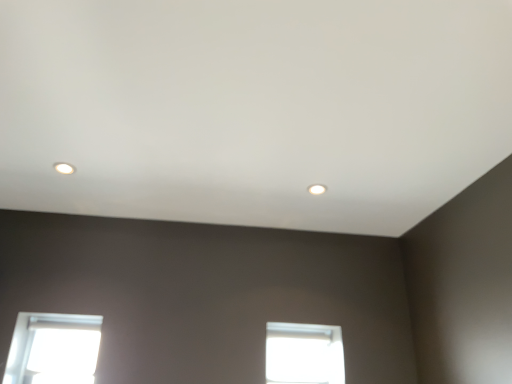
Question: Can you confirm if transparent glass window at lower left, the 1th window in the left-to-right sequence, is positioned to the right of matte white light fixture at upper center, marked as the 2th lighting in a left-to-right arrangement?

Choices:
 (A) no
 (B) yes

Answer: (A)

Question: Considering the relative positions of transparent glass window at lower left, which is the 2th window in right-to-left order, and matte white light fixture at upper center, which is the second lighting in front-to-back order, in the image provided, is transparent glass window at lower left, which is the 2th window in right-to-left order, behind matte white light fixture at upper center, which is the second lighting in front-to-back order,?

Choices:
 (A) no
 (B) yes

Answer: (B)

Question: Are transparent glass window at lower left, which is the 2th window in right-to-left order, and matte white light fixture at upper center, positioned as the second lighting in top-to-bottom order, making contact?

Choices:
 (A) no
 (B) yes

Answer: (A)

Question: Is matte white light fixture at upper center, positioned as the second lighting in top-to-bottom order, at the back of transparent glass window at lower left, the 1th window in the left-to-right sequence?

Choices:
 (A) yes
 (B) no

Answer: (B)

Question: Is transparent glass window at lower left, the 1th window in the left-to-right sequence, positioned in front of matte white light fixture at upper center, which is the 1th lighting from bottom to top?

Choices:
 (A) no
 (B) yes

Answer: (A)

Question: From the image's perspective, is matte white light fixture at upper left, the 2th lighting positioned from the right, positioned above or below matte white light fixture at upper center, positioned as the second lighting in top-to-bottom order?

Choices:
 (A) below
 (B) above

Answer: (B)

Question: Is point (67, 165) positioned closer to the camera than point (322, 185)?

Choices:
 (A) farther
 (B) closer

Answer: (B)

Question: From a real-world perspective, is matte white light fixture at upper left, which ranks as the first lighting in left-to-right order, physically located above or below matte white light fixture at upper center, which is the second lighting in front-to-back order?

Choices:
 (A) above
 (B) below

Answer: (A)

Question: Relative to matte white light fixture at upper center, which appears as the 1th lighting when viewed from the right, is matte white light fixture at upper left, the 1th lighting in the top-to-bottom sequence, in front or behind?

Choices:
 (A) front
 (B) behind

Answer: (A)

Question: From a real-world perspective, is transparent glass window at center, positioned as the 1th window in right-to-left order, positioned above or below matte white light fixture at upper center, which ranks as the first lighting in back-to-front order?

Choices:
 (A) below
 (B) above

Answer: (A)

Question: Does point (276, 352) appear closer or farther from the camera than point (315, 188)?

Choices:
 (A) farther
 (B) closer

Answer: (A)

Question: Choose the correct answer: Is transparent glass window at center, positioned as the 1th window in right-to-left order, inside matte white light fixture at upper center, which ranks as the first lighting in back-to-front order, or outside it?

Choices:
 (A) outside
 (B) inside

Answer: (A)

Question: Considering their positions, is transparent glass window at center, positioned as the 1th window in right-to-left order, located in front of or behind matte white light fixture at upper center, which ranks as the first lighting in back-to-front order?

Choices:
 (A) behind
 (B) front

Answer: (A)

Question: From a real-world perspective, is matte white light fixture at upper left, the 1th lighting in the top-to-bottom sequence, above or below transparent glass window at center, which is the second window from left to right?

Choices:
 (A) above
 (B) below

Answer: (A)

Question: Considering the positions of point (72, 165) and point (293, 327), is point (72, 165) closer or farther from the camera than point (293, 327)?

Choices:
 (A) farther
 (B) closer

Answer: (B)